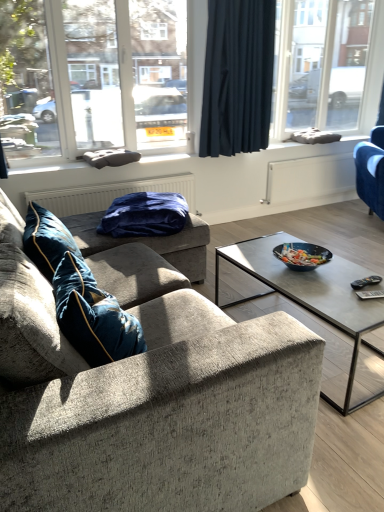
Image resolution: width=384 pixels, height=512 pixels. Describe the element at coordinates (366, 282) in the screenshot. I see `black plastic remote at lower right` at that location.

This screenshot has width=384, height=512. Identify the location of velvet blue armchair at right, which is the 2th studio couch in left-to-right order. (371, 170).

You are a GUI agent. You are given a task and a screenshot of the screen. Output one action in this format:
    pyautogui.click(x=<x>, y=<y>)
    Task: Click on the velvet blue pillow at left, the first pillow positioned from the front
    The image size is (384, 512).
    Given the screenshot: What is the action you would take?
    pyautogui.click(x=47, y=240)

At what (x,y) coordinates should I click in order to perform the action: click on black plastic remote at lower right. Please return your answer as a coordinate pair (x, y). Looking at the image, I should click on (366, 282).

Is blue plush blanket at center, the first pillow positioned from the back, aimed at textured gray couch at center, the 1th studio couch from the front?

Yes, blue plush blanket at center, the first pillow positioned from the back, is aimed at textured gray couch at center, the 1th studio couch from the front.

Between blue plush blanket at center, the first pillow positioned from the back, and textured gray couch at center, which is the first studio couch in left-to-right order, which one is positioned behind?

blue plush blanket at center, the first pillow positioned from the back, is more distant.

Can you tell me how much blue plush blanket at center, the first pillow positioned from the back, and textured gray couch at center, which is the first studio couch in left-to-right order, differ in facing direction?

The angle between the facing direction of blue plush blanket at center, the first pillow positioned from the back, and the facing direction of textured gray couch at center, which is the first studio couch in left-to-right order, is 24.4 degrees.

Considering the sizes of objects blue plush blanket at center, which is the second pillow from front to back, and textured gray couch at center, the 1th studio couch from the front, in the image provided, who is wider, blue plush blanket at center, which is the second pillow from front to back, or textured gray couch at center, the 1th studio couch from the front,?

textured gray couch at center, the 1th studio couch from the front, is wider.

From the image's perspective, which one is positioned higher, blue plush blanket at center, the first pillow positioned from the back, or velvet blue armchair at right, which ranks as the 1th studio couch in back-to-front order?

velvet blue armchair at right, which ranks as the 1th studio couch in back-to-front order, is shown above in the image.

From a real-world perspective, which is physically below, blue plush blanket at center, the first pillow positioned from the back, or velvet blue armchair at right, which ranks as the 1th studio couch in back-to-front order?

velvet blue armchair at right, which ranks as the 1th studio couch in back-to-front order, from a real-world perspective.

Considering the sizes of objects blue plush blanket at center, which is the second pillow from front to back, and velvet blue armchair at right, which ranks as the second studio couch in front-to-back order, in the image provided, who is shorter, blue plush blanket at center, which is the second pillow from front to back, or velvet blue armchair at right, which ranks as the second studio couch in front-to-back order,?

Answer: Standing shorter between the two is blue plush blanket at center, which is the second pillow from front to back.

How distant is blue plush blanket at center, the first pillow positioned from the back, from velvet blue armchair at right, which ranks as the 1th studio couch in back-to-front order?

They are 7.72 feet apart.

Measure the distance from transparent glass window at upper left, marked as the first window in a left-to-right arrangement, to velvet blue armchair at right, which ranks as the 1th studio couch in back-to-front order.

The distance of transparent glass window at upper left, marked as the first window in a left-to-right arrangement, from velvet blue armchair at right, which ranks as the 1th studio couch in back-to-front order, is 7.63 feet.

From a real-world perspective, is transparent glass window at upper left, which ranks as the 1th window in front-to-back order, on velvet blue armchair at right, which ranks as the second studio couch in front-to-back order?

Yes, from a real-world perspective, transparent glass window at upper left, which ranks as the 1th window in front-to-back order, is on top of velvet blue armchair at right, which ranks as the second studio couch in front-to-back order.

Which object is wider, transparent glass window at upper left, marked as the first window in a left-to-right arrangement, or velvet blue armchair at right, acting as the first studio couch starting from the right?

velvet blue armchair at right, acting as the first studio couch starting from the right, is wider.

From the picture: Who is smaller, transparent glass window at upper left, the second window positioned from the right, or velvet blue armchair at right, which ranks as the 1th studio couch in back-to-front order?

transparent glass window at upper left, the second window positioned from the right.

Can you tell me how much textured gray couch at center, which is the first studio couch in left-to-right order, and dark blue fabric curtain at upper center differ in facing direction?

The facing directions of textured gray couch at center, which is the first studio couch in left-to-right order, and dark blue fabric curtain at upper center are 88.8 degrees apart.

Considering their positions, is textured gray couch at center, which is the first studio couch in left-to-right order, located in front of or behind dark blue fabric curtain at upper center?

textured gray couch at center, which is the first studio couch in left-to-right order, is in front of dark blue fabric curtain at upper center.

Consider the image. Do you think textured gray couch at center, arranged as the 2th studio couch when viewed from the back, is within dark blue fabric curtain at upper center, or outside of it?

textured gray couch at center, arranged as the 2th studio couch when viewed from the back, lies outside dark blue fabric curtain at upper center.

Is there a large distance between textured gray couch at center, the 1th studio couch from the front, and dark blue fabric curtain at upper center?

That's right, there is a large distance between textured gray couch at center, the 1th studio couch from the front, and dark blue fabric curtain at upper center.

Is transparent glass window at upper left, the second window positioned from the right, in front of or behind transparent glass window at upper right, the second window when ordered from front to back, in the image?

transparent glass window at upper left, the second window positioned from the right, is positioned closer to the viewer than transparent glass window at upper right, the second window when ordered from front to back.

Looking at the image, does transparent glass window at upper left, which is the 2th window in back-to-front order, seem bigger or smaller compared to transparent glass window at upper right, the second window when ordered from front to back?

transparent glass window at upper left, which is the 2th window in back-to-front order, is smaller than transparent glass window at upper right, the second window when ordered from front to back.

How many degrees apart are the facing directions of transparent glass window at upper left, the second window positioned from the right, and transparent glass window at upper right, the first window from the back?

There is a 0.0021-degree angle between the facing directions of transparent glass window at upper left, the second window positioned from the right, and transparent glass window at upper right, the first window from the back.

Would you say velvet blue pillow at left, acting as the second pillow starting from the back, is to the left or to the right of black plastic remote at lower right in the picture?

Based on their positions, velvet blue pillow at left, acting as the second pillow starting from the back, is located to the left of black plastic remote at lower right.

Considering the positions of objects velvet blue pillow at left, acting as the second pillow starting from the back, and black plastic remote at lower right in the image provided, who is behind, velvet blue pillow at left, acting as the second pillow starting from the back, or black plastic remote at lower right?

black plastic remote at lower right is more distant.

Considering the sizes of velvet blue pillow at left, acting as the second pillow starting from the back, and black plastic remote at lower right in the image, is velvet blue pillow at left, acting as the second pillow starting from the back, taller or shorter than black plastic remote at lower right?

Clearly, velvet blue pillow at left, acting as the second pillow starting from the back, is taller compared to black plastic remote at lower right.

Is point (373, 204) closer to viewer compared to point (135, 217)?

No, it is behind (135, 217).

Is velvet blue armchair at right, acting as the first studio couch starting from the right, positioned with its back to blue plush blanket at center, the first pillow positioned from the back?

That's not correct — velvet blue armchair at right, acting as the first studio couch starting from the right, is not looking away from blue plush blanket at center, the first pillow positioned from the back.

Could you measure the distance between velvet blue armchair at right, which ranks as the second studio couch in front-to-back order, and blue plush blanket at center, the first pillow positioned from the back?

2.35 meters.

Where is `studio couch that is on the right side of blue plush blanket at center, the first pillow positioned from the back`? studio couch that is on the right side of blue plush blanket at center, the first pillow positioned from the back is located at coordinates (371, 170).

Identify the location of studio couch that is the 1st object directly below the blue plush blanket at center, which is the second pillow from front to back (from a real-world perspective). The height and width of the screenshot is (512, 384). (150, 397).

From the velvet blue armchair at right, acting as the first studio couch starting from the right, count 1st pillows forward and point to it. Please provide its 2D coordinates.

[(145, 215)]

Which object lies nearer to the anchor point dark blue fabric curtain at upper center, transparent glass window at upper left, the second window positioned from the right, or black plastic remote at lower right?

transparent glass window at upper left, the second window positioned from the right.

Estimate the real-world distances between objects in this image. Which object is closer to transparent glass window at upper right, which appears as the first window when viewed from the right, transparent glass window at upper left, marked as the first window in a left-to-right arrangement, or textured gray couch at center, arranged as the 2th studio couch when viewed from the back?

Among the two, transparent glass window at upper left, marked as the first window in a left-to-right arrangement, is located nearer to transparent glass window at upper right, which appears as the first window when viewed from the right.

Which object lies further to the anchor point transparent glass window at upper left, the second window positioned from the right, transparent glass window at upper right, the first window from the back, or velvet blue pillow at left, acting as the second pillow starting from the back?

The object further to transparent glass window at upper left, the second window positioned from the right, is transparent glass window at upper right, the first window from the back.

Looking at the image, which one is located closer to black plastic remote at lower right, velvet blue armchair at right, which ranks as the 1th studio couch in back-to-front order, or blue plush blanket at center, which is the second pillow from front to back?

blue plush blanket at center, which is the second pillow from front to back.

Based on their spatial positions, is velvet blue armchair at right, which is the 2th studio couch in left-to-right order, or black plastic remote at lower right closer to dark blue fabric curtain at upper center?

velvet blue armchair at right, which is the 2th studio couch in left-to-right order, is closer to dark blue fabric curtain at upper center.

Estimate the real-world distances between objects in this image. Which object is closer to velvet blue pillow at left, acting as the second pillow starting from the back, transparent glass window at upper left, the second window positioned from the right, or velvet blue armchair at right, which ranks as the second studio couch in front-to-back order?

transparent glass window at upper left, the second window positioned from the right, is closer to velvet blue pillow at left, acting as the second pillow starting from the back.

When comparing their distances from dark blue fabric curtain at upper center, does blue plush blanket at center, which is the second pillow from front to back, or velvet blue armchair at right, which ranks as the 1th studio couch in back-to-front order, seem further?

blue plush blanket at center, which is the second pillow from front to back, is positioned further to the anchor dark blue fabric curtain at upper center.

Estimate the real-world distances between objects in this image. Which object is closer to velvet blue armchair at right, which is the 2th studio couch in left-to-right order, velvet blue pillow at left, acting as the second pillow starting from the back, or transparent glass window at upper right, the second window when ordered from front to back?

transparent glass window at upper right, the second window when ordered from front to back.

What are the coordinates of `studio couch between textured gray couch at center, which is the first studio couch in left-to-right order, and transparent glass window at upper right, the second window when ordered from front to back, along the z-axis` in the screenshot? It's located at (371, 170).

This screenshot has width=384, height=512. Identify the location of curtain between transparent glass window at upper left, marked as the first window in a left-to-right arrangement, and transparent glass window at upper right, the second window when ordered from front to back. (237, 77).

Locate an element on the screen. This screenshot has height=512, width=384. pillow between transparent glass window at upper left, which is the 2th window in back-to-front order, and velvet blue pillow at left, the first pillow positioned from the front, from top to bottom is located at coordinates (145, 215).

You are a GUI agent. You are given a task and a screenshot of the screen. Output one action in this format:
    pyautogui.click(x=<x>, y=<y>)
    Task: Click on the window located between blue plush blanket at center, which is the second pillow from front to back, and velvet blue armchair at right, which ranks as the second studio couch in front-to-back order, in the left-right direction
    The image size is (384, 512).
    Given the screenshot: What is the action you would take?
    tap(327, 65)